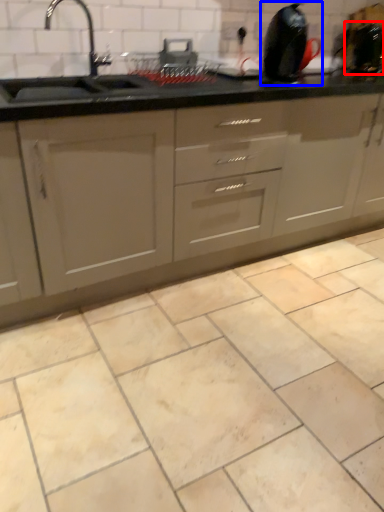
Question: Which object is closer to the camera taking this photo, appliance (highlighted by a red box) or appliance (highlighted by a blue box)?

Choices:
 (A) appliance
 (B) appliance

Answer: (B)